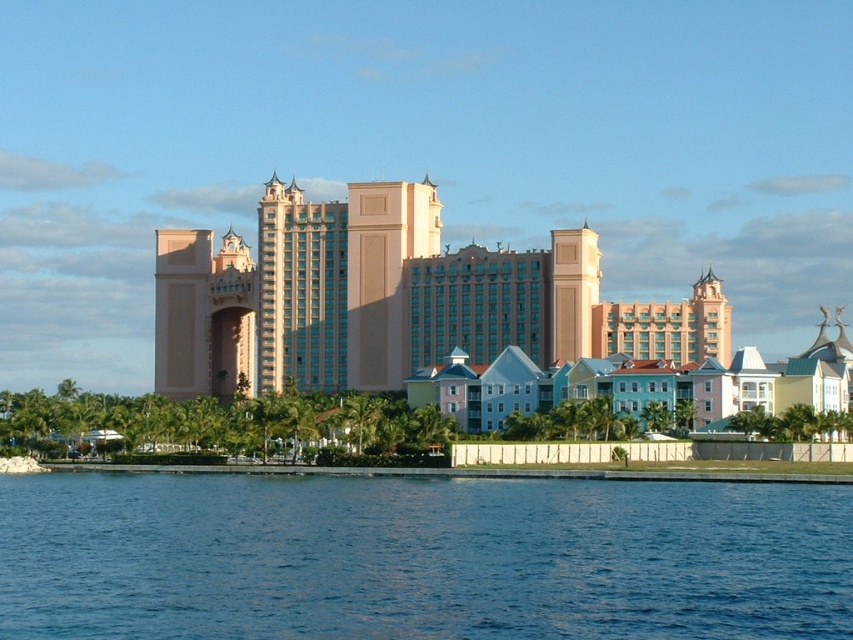
Does blue liquid water at lower center appear on the left side of pink smooth building at center?

Indeed, blue liquid water at lower center is positioned on the left side of pink smooth building at center.

Between point (192, 531) and point (421, 208), which one is positioned behind?

Positioned behind is point (421, 208).

Where is `blue liquid water at lower center`? The height and width of the screenshot is (640, 853). blue liquid water at lower center is located at coordinates (419, 557).